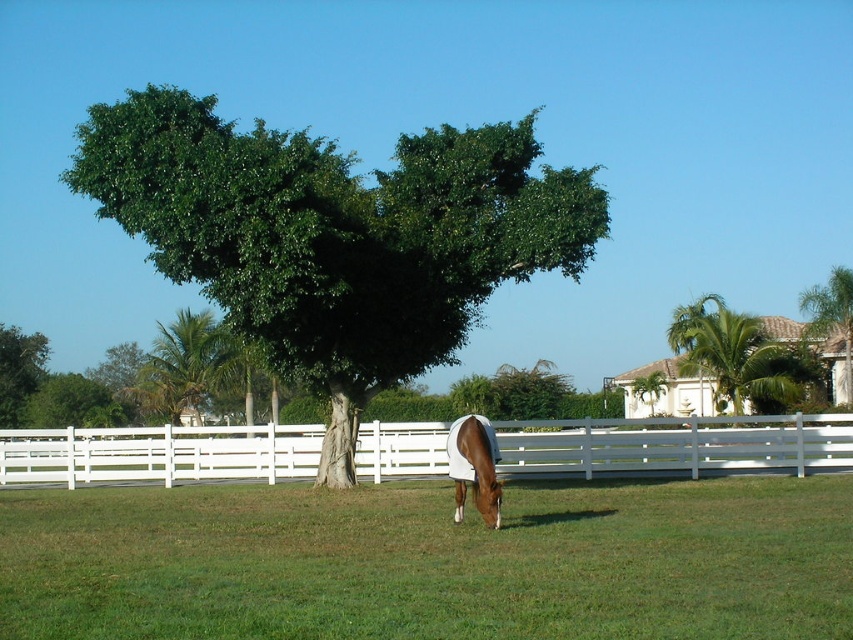
Question: Does green leafy palm tree at upper right come behind brown glossy horse at center?

Choices:
 (A) yes
 (B) no

Answer: (A)

Question: Can you confirm if green leafy palm tree at left is thinner than brown glossy horse at center?

Choices:
 (A) no
 (B) yes

Answer: (A)

Question: Which point is closer to the camera?

Choices:
 (A) green leafy tree at upper right
 (B) white wooden fence at center
 (C) green leafy tree at center

Answer: (C)

Question: Which point is farther to the camera?

Choices:
 (A) (141, 404)
 (B) (0, 392)
 (C) (848, 385)
 (D) (322, 502)

Answer: (B)

Question: Where is green leafy tree at center located in relation to white wooden fence at center in the image?

Choices:
 (A) below
 (B) above

Answer: (B)

Question: Which object is closer to the camera taking this photo?

Choices:
 (A) green leafy palm tree at left
 (B) green leafy tree at left
 (C) green grass at center

Answer: (C)